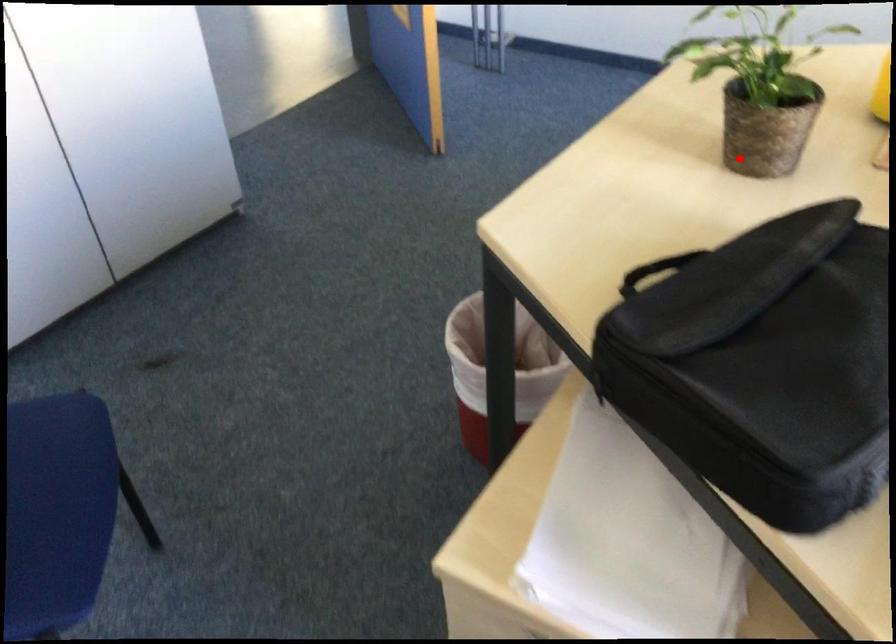
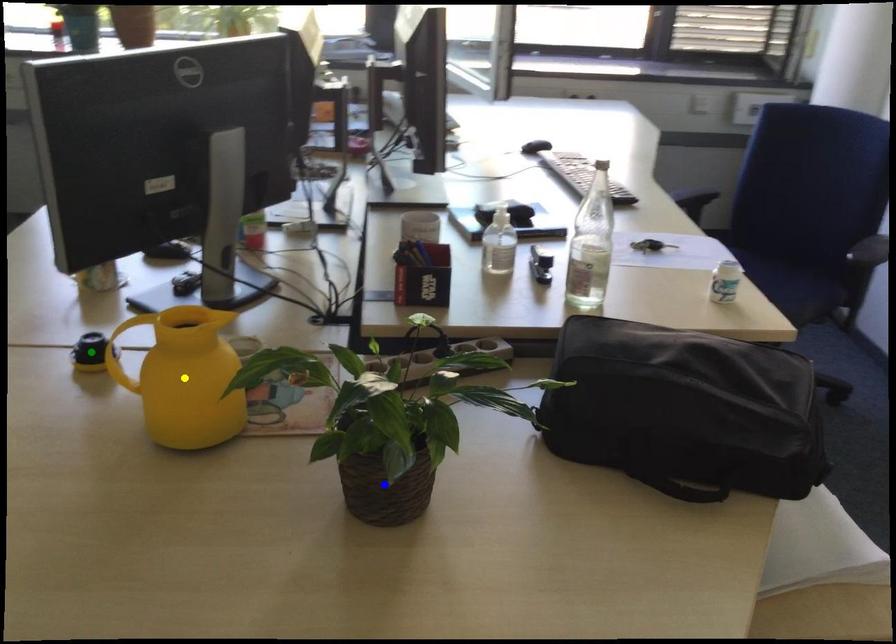
Question: I am providing you with two images of the same scene from different viewpoints. A red point is marked on the first image. You are given multiple points on the second image. Which mark in image 2 goes with the point in image 1?

Choices:
 (A) yellow point
 (B) green point
 (C) blue point

Answer: (C)